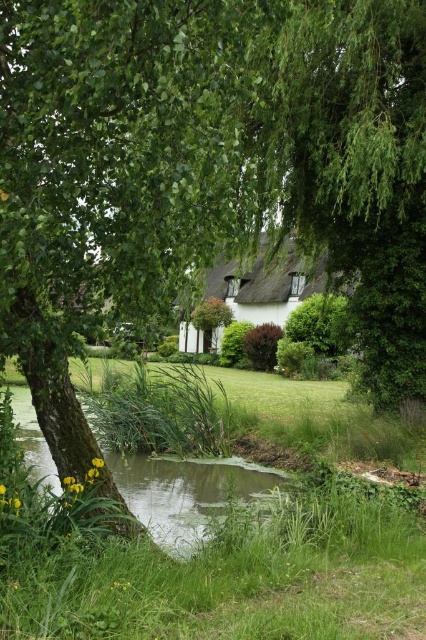
Question: Which point is closer to the camera taking this photo?

Choices:
 (A) (244, 481)
 (B) (319, 282)

Answer: (A)

Question: Estimate the real-world distances between objects in this image. Which object is farther from the green grass at lower left?

Choices:
 (A) green grassy water at lower left
 (B) thatched roof cottage at center

Answer: (B)

Question: Is green grass at lower left smaller than thatched roof cottage at center?

Choices:
 (A) no
 (B) yes

Answer: (B)

Question: Which point is closer to the camera taking this photo?

Choices:
 (A) (377, 584)
 (B) (253, 266)

Answer: (A)

Question: Is green grassy water at lower left to the right of thatched roof cottage at center from the viewer's perspective?

Choices:
 (A) no
 (B) yes

Answer: (A)

Question: Is green grass at lower left below green grassy water at lower left?

Choices:
 (A) yes
 (B) no

Answer: (B)